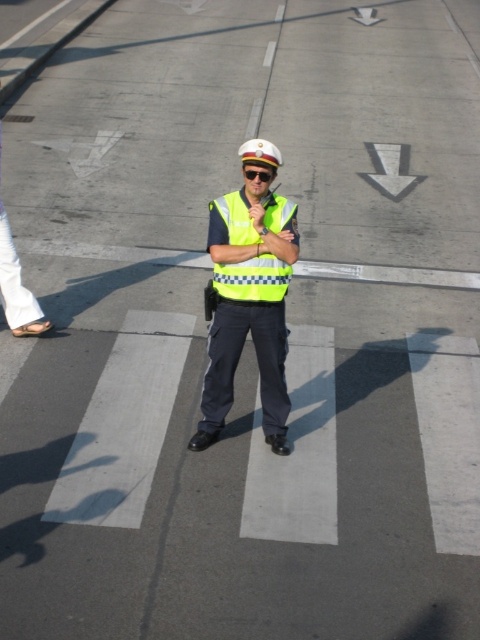
Measure the distance between reflective yellow vest at center and camera.

They are 14.06 feet apart.

Consider the image. How much distance is there between reflective yellow vest at center and yellow reflective safety vest at center?

They are 7.66 inches apart.

Who is more distant from viewer, (257, 196) or (249, 227)?

The point (249, 227) is more distant.

I want to click on reflective yellow vest at center, so click(250, 294).